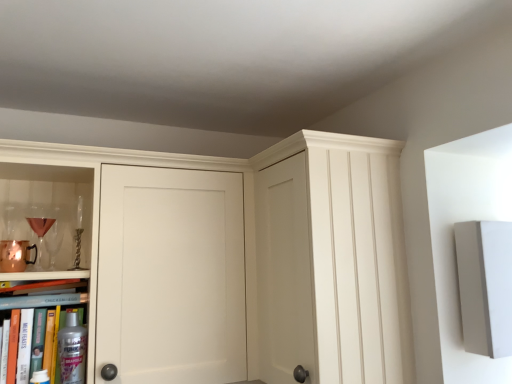
Question: Is transparent glass cabinet at center looking in the opposite direction of hardcover book at lower left, the first book from the top?

Choices:
 (A) yes
 (B) no

Answer: (B)

Question: Is the position of transparent glass cabinet at center less distant than that of hardcover book at lower left, the first book from the top?

Choices:
 (A) no
 (B) yes

Answer: (B)

Question: From the image's perspective, is transparent glass cabinet at center located above hardcover book at lower left, placed as the second book when sorted from bottom to top?

Choices:
 (A) no
 (B) yes

Answer: (B)

Question: Is transparent glass cabinet at center next to hardcover book at lower left, the first book from the top?

Choices:
 (A) yes
 (B) no

Answer: (B)

Question: Could you tell me if transparent glass cabinet at center is facing hardcover book at lower left, the first book from the top?

Choices:
 (A) yes
 (B) no

Answer: (A)

Question: Does transparent glass cabinet at center have a smaller size compared to hardcover book at lower left, the first book from the top?

Choices:
 (A) no
 (B) yes

Answer: (A)

Question: Considering the relative positions of hardcover book at lower left, placed as the second book when sorted from bottom to top, and matte gold wine glass at left, arranged as the second wine glass when viewed from the back, in the image provided, is hardcover book at lower left, placed as the second book when sorted from bottom to top, to the right of matte gold wine glass at left, arranged as the second wine glass when viewed from the back, from the viewer's perspective?

Choices:
 (A) yes
 (B) no

Answer: (A)

Question: Is hardcover book at lower left, the first book from the top, positioned beyond the bounds of matte gold wine glass at left, arranged as the second wine glass when viewed from the back?

Choices:
 (A) no
 (B) yes

Answer: (B)

Question: From the image's perspective, does hardcover book at lower left, placed as the second book when sorted from bottom to top, appear higher than matte gold wine glass at left, acting as the first wine glass starting from the front?

Choices:
 (A) no
 (B) yes

Answer: (A)

Question: Can you confirm if hardcover book at lower left, placed as the second book when sorted from bottom to top, is bigger than matte gold wine glass at left, arranged as the second wine glass when viewed from the back?

Choices:
 (A) yes
 (B) no

Answer: (A)

Question: Considering the relative sizes of hardcover book at lower left, placed as the second book when sorted from bottom to top, and matte gold wine glass at left, acting as the first wine glass starting from the front, in the image provided, is hardcover book at lower left, placed as the second book when sorted from bottom to top, thinner than matte gold wine glass at left, acting as the first wine glass starting from the front,?

Choices:
 (A) yes
 (B) no

Answer: (B)

Question: Can you confirm if hardcover book at lower left, placed as the second book when sorted from bottom to top, is shorter than matte gold wine glass at left, acting as the first wine glass starting from the front?

Choices:
 (A) yes
 (B) no

Answer: (A)

Question: Does metallic silver spray can at lower left, positioned as the 2th book in top-to-bottom order, contain matte gold wine glass at left, acting as the first wine glass starting from the front?

Choices:
 (A) yes
 (B) no

Answer: (B)